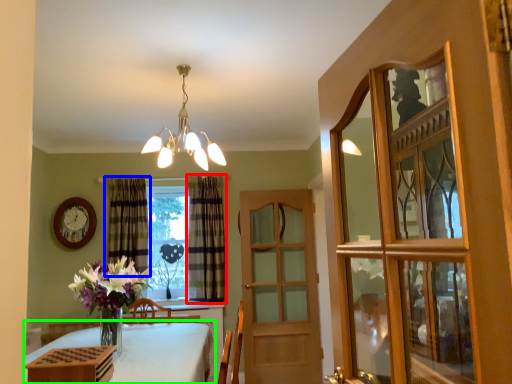
Question: Which is nearer to the curtain (highlighted by a red box)? curtain (highlighted by a blue box) or table (highlighted by a green box).

Choices:
 (A) curtain
 (B) table

Answer: (A)